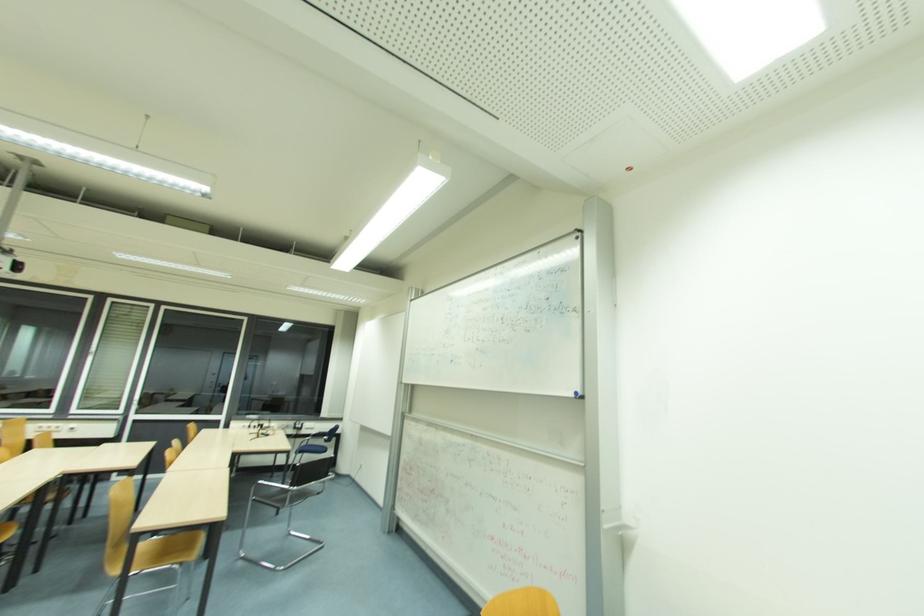
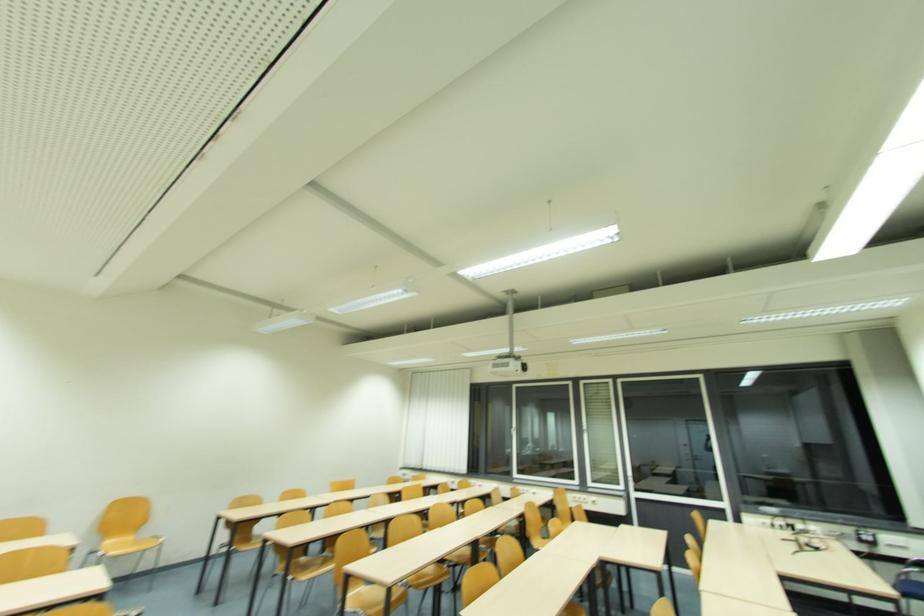
The first image is from the beginning of the video and the second image is from the end. How did the camera likely rotate when shooting the video?

The camera's rotation is toward left-up.